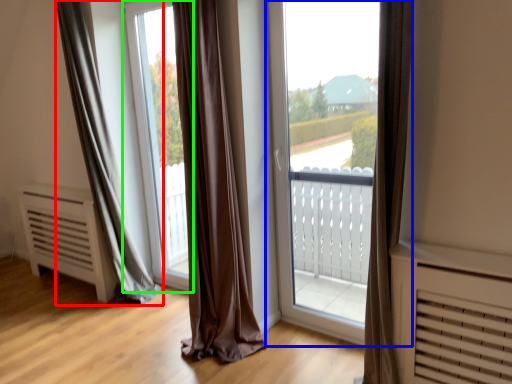
Question: Which object is the closest to the curtain (highlighted by a red box)? Choose among these: window (highlighted by a blue box) or window screen (highlighted by a green box).

Choices:
 (A) window
 (B) window screen

Answer: (B)